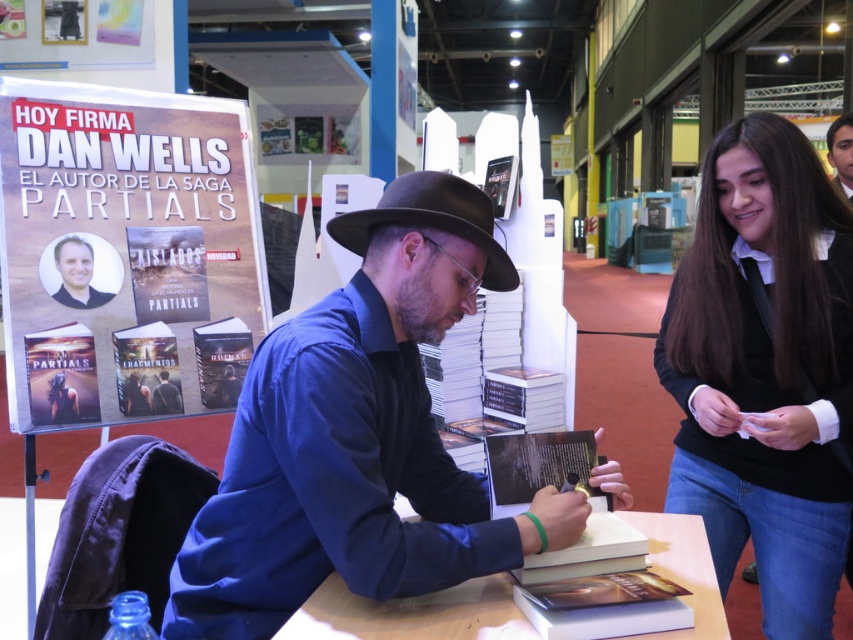
You are an event organizer at the convention center. You need to ensure that all promotional materials are visible to attendees. Given the smooth skin face at upper right and the matte blue shirt at center, which object is located higher up in the image?

The smooth skin face at upper right is positioned over the matte blue shirt at center, meaning it is higher up in the image.